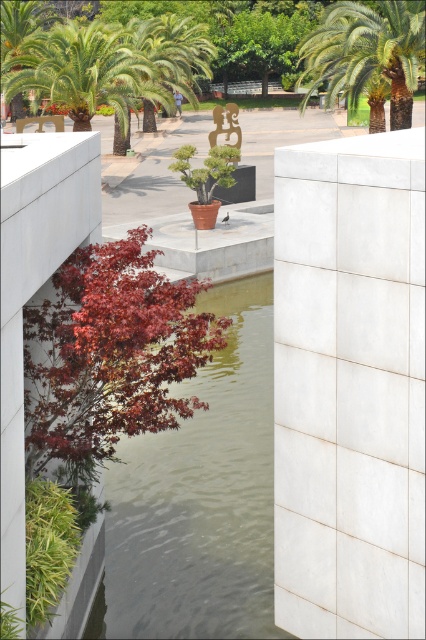
You are a visitor standing in the garden and want to take a photo of the white concrete pillar at center and the green leafy palm tree at upper left. Which object is directly above the other?

The green leafy palm tree at upper left is directly above the white concrete pillar at center.

You are a landscape architect designing a pathway through this outdoor space. You need to place a new statue that is 1.2 meters tall. The statue must be placed where it won not block the view of the white concrete pillar at center. Based on the scene description and the objects provided, can the statue be placed next to the greenish water at center without obstructing the pillar?

The white concrete pillar at center is taller than the greenish water at center. Since the statue is 1.2 meters tall, it can be placed next to the greenish water at center without blocking the view of the pillar, as the pillar itself is already taller than the water level. However, ensure the statue doesn not physically block the line of sight to the pillar depending on its placement location.

You are an architect designing a new pathway that must pass exactly through the point where the white concrete pillar at center is located. According to the image, what is the exact coordinate of the point where the pathway must be constructed?

The exact coordinate for the white concrete pillar at center is at point (350, 387), so the pathway must be constructed at that point.